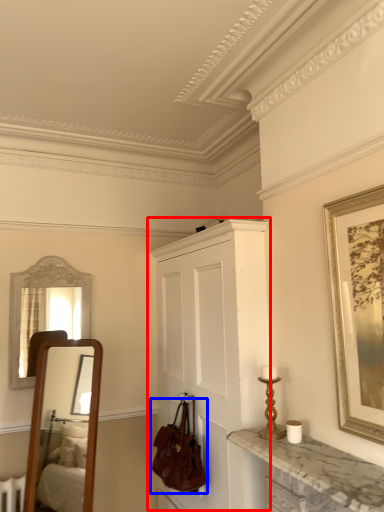
Question: Which of the following is the farthest to the observer, cabinetry (highlighted by a red box) or handbag (highlighted by a blue box)?

Choices:
 (A) cabinetry
 (B) handbag

Answer: (B)